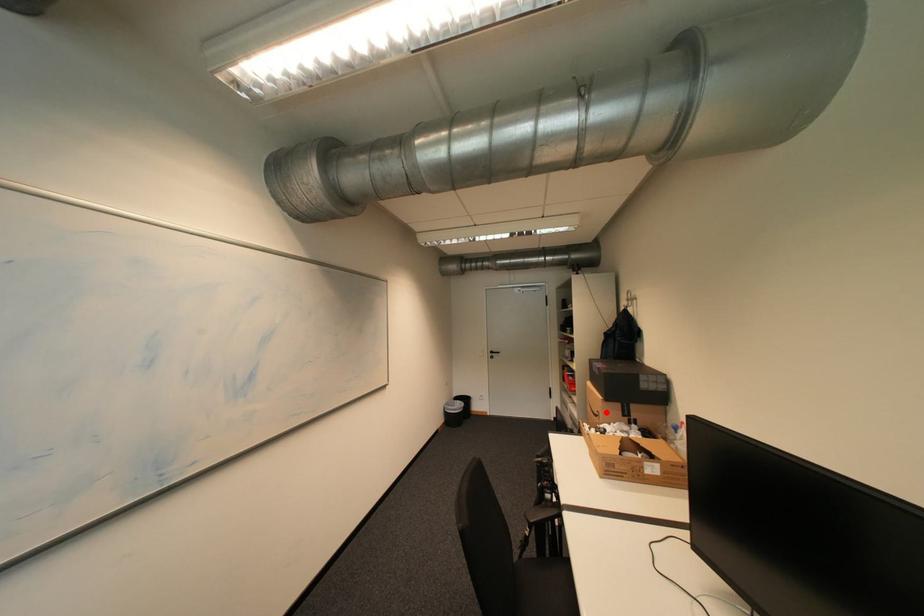
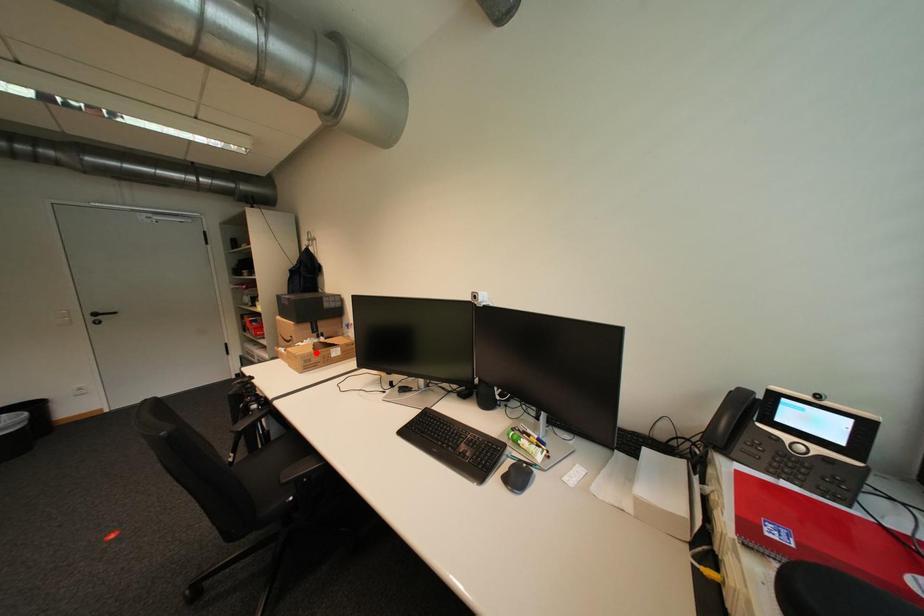
I am providing you with two images of the same scene from different viewpoints. A red point is marked on the first image and another point is marked on the second image. Are the points marked in image1 and image2 representing the same 3D position?

No